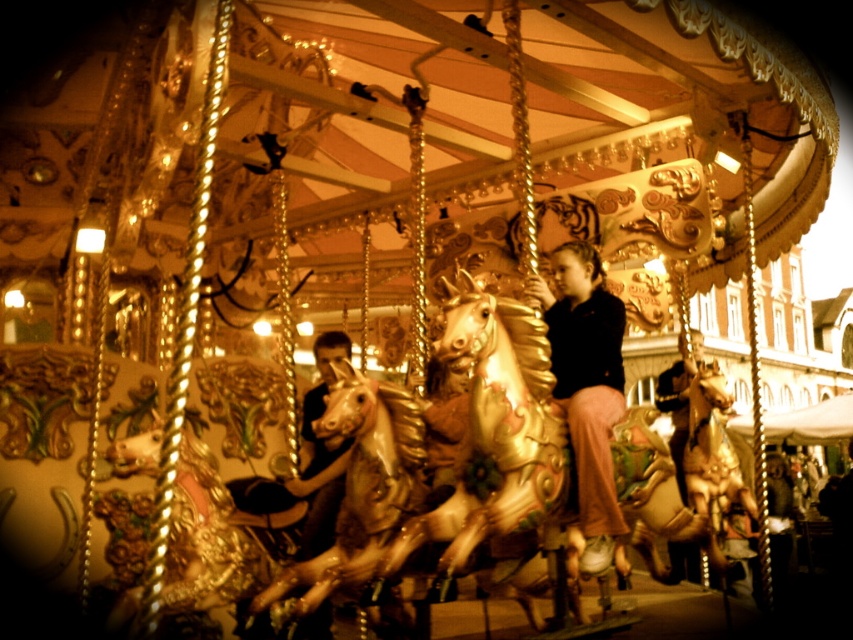
You are a photographer at the fairground and want to capture both the matte black jacket at center and the matte black shirt at center in a single photo. Since you want the jacket to be on the left side of the photo, should you adjust your position to the right or left of the carousel?

The matte black jacket at center is positioned on the right side of matte black shirt at center. To have the jacket on the left in the photo, you should move to the right side of the carousel so that the jacket shifts to the left relative to your viewpoint.

You are standing at the entrance of the carousel and want to greet both the person wearing the matte black jacket at center and the matte black shirt at center. Since you can only walk to one of them, which one is closer to you?

The distance between the matte black jacket at center and the matte black shirt at center is 8.23 meters, so you cannot determine which is closer without additional information about their positions relative to the entrance.

Where is the matte black jacket at center located in the image?

The matte black jacket at center is located at point coordinates of (587, 390).